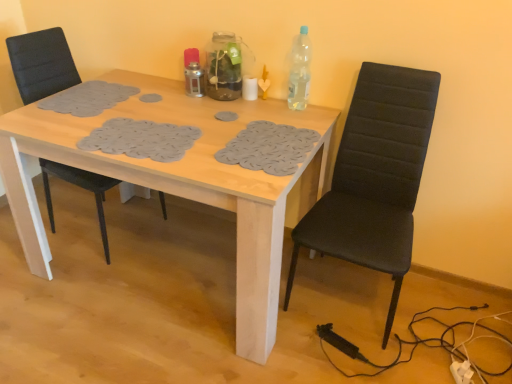
The image size is (512, 384). In order to click on vacant space to the left of clear plastic bottle at upper right in this screenshot , I will do `click(264, 109)`.